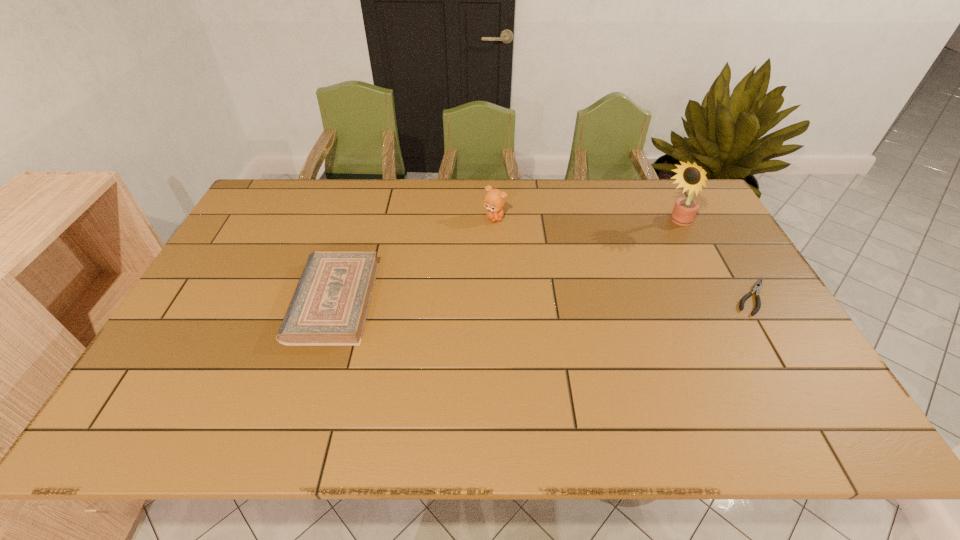
Locate an element on the screen. The image size is (960, 540). free space that satisfies the following two spatial constraints: 1. on the front side of the sunflower; 2. on the right side of the second object from left to right is located at coordinates (494, 224).

At what (x,y) coordinates should I click in order to perform the action: click on vacant space that satisfies the following two spatial constraints: 1. on the front side of the sunflower; 2. on the right side of the teddy bear. Please return your answer as a coordinate pair (x, y). This screenshot has width=960, height=540. Looking at the image, I should click on (494, 224).